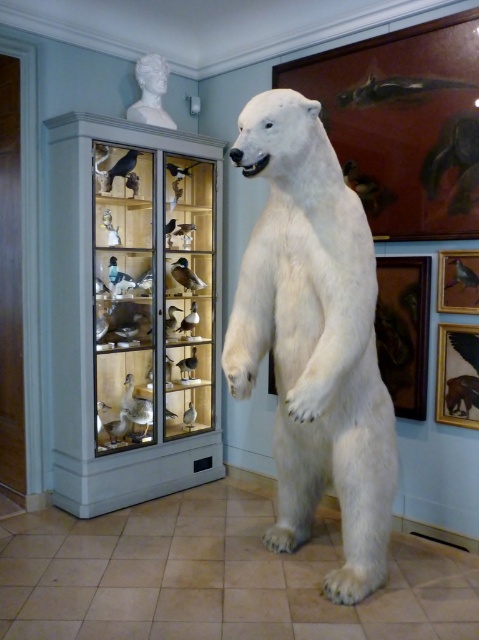
You are an art curator planning to rearrange the museum layout. You need to place a new sculpture that is 1.2 meters wide between the white fur polar bear at center and the white marble bust at upper center. Based on their current widths, will there be enough space for the sculpture between them?

The white fur polar bear at center is wider than the white marble bust at upper center. Since the sculpture is 1.2 meters wide, the space between them may be sufficient if the distance between the two objects is at least 1.2 meters. However, the exact width of the objects themselves doesn

You are standing in the museum and want to take a photo of the white fur polar bear at center. If you are positioned at the entrance, which is at the bottom left corner of the room, where should you aim your camera to capture the bear in the frame?

You should aim your camera towards the center of the room since the white fur polar bear at center is positioned at point (314, 339), which is near the center coordinates.